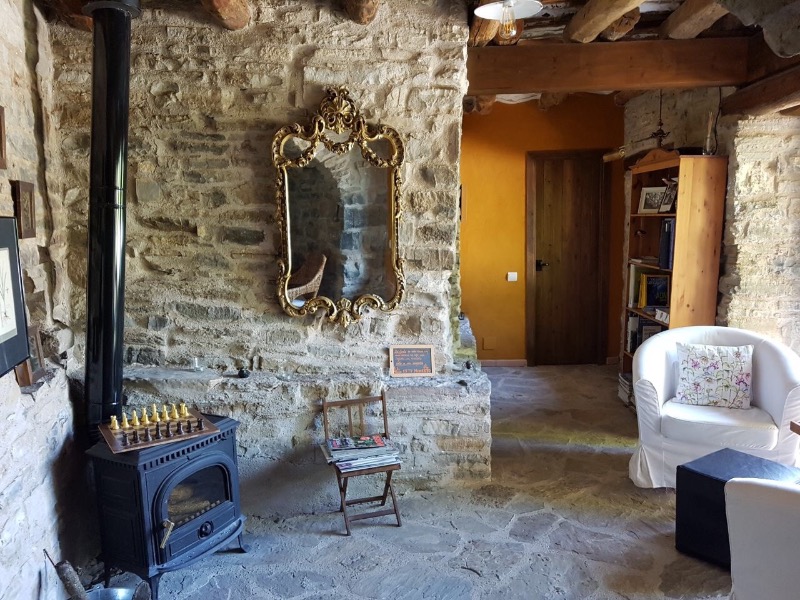
Where is `wood stove`? The width and height of the screenshot is (800, 600). wood stove is located at coordinates (x=192, y=534).